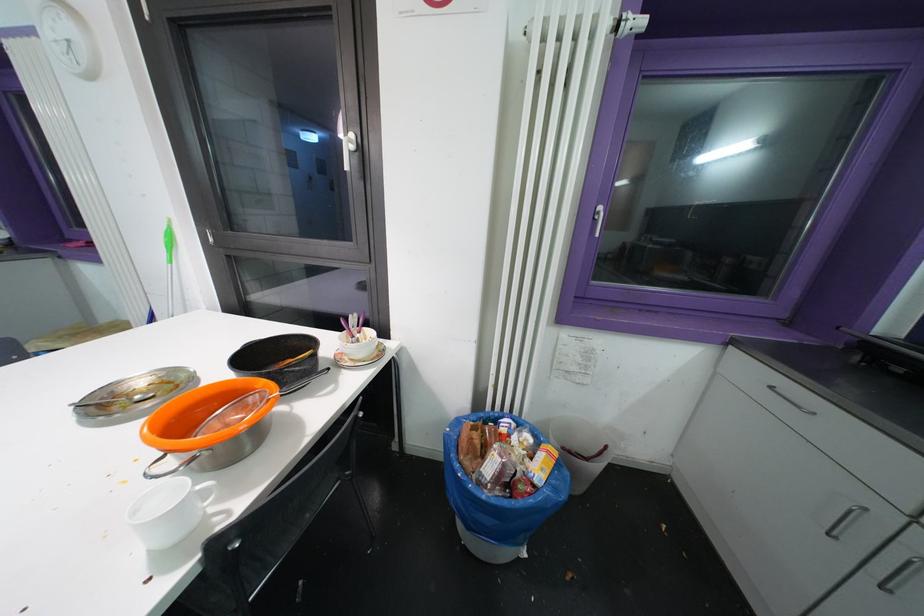
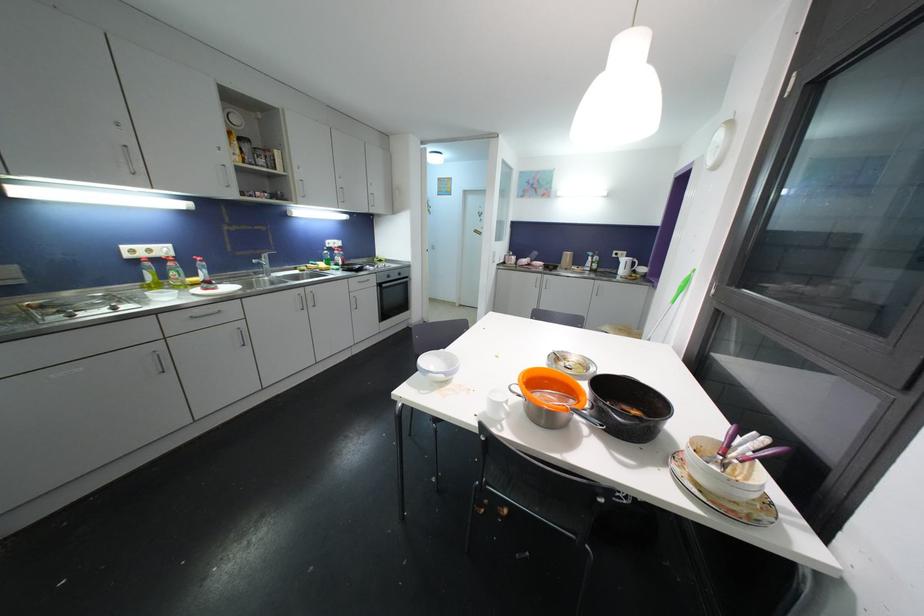
The first image is from the beginning of the video and the second image is from the end. How did the camera likely rotate when shooting the video?

The rotation direction of the camera is left-down.